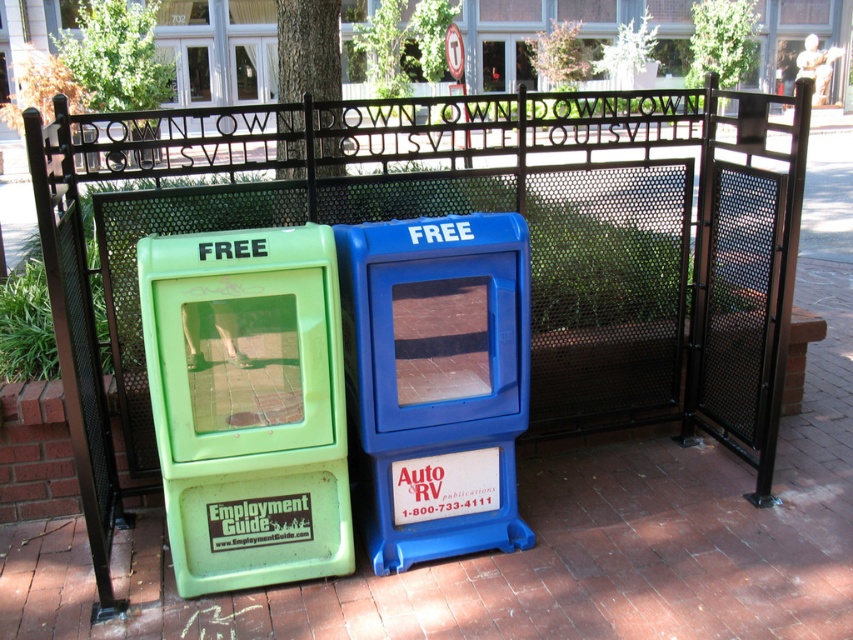
Question: Can you confirm if green plastic employment guide box at left is thinner than blue plastic box at center?

Choices:
 (A) no
 (B) yes

Answer: (B)

Question: Which point is farther to the camera?

Choices:
 (A) (225, 573)
 (B) (357, 422)

Answer: (B)

Question: Does green plastic employment guide box at left have a smaller size compared to blue plastic box at center?

Choices:
 (A) no
 (B) yes

Answer: (B)

Question: Does green plastic employment guide box at left have a smaller size compared to blue plastic box at center?

Choices:
 (A) yes
 (B) no

Answer: (A)

Question: Which point is closer to the camera?

Choices:
 (A) (270, 243)
 (B) (500, 467)

Answer: (A)